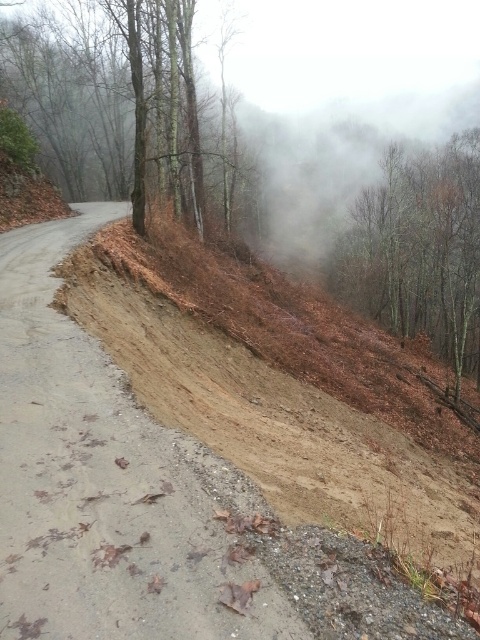
Question: Estimate the real-world distances between objects in this image. Which object is farther from the brown sandy dirt track at center?

Choices:
 (A) brown matte tree at upper right
 (B) brown bark tree at upper center

Answer: (A)

Question: Which object is farther from the camera taking this photo?

Choices:
 (A) brown matte tree at upper right
 (B) brown sandy dirt track at center
 (C) brown bark tree at upper center

Answer: (A)

Question: Which object appears farthest from the camera in this image?

Choices:
 (A) brown matte tree at upper right
 (B) brown bark tree at upper center
 (C) brown sandy dirt track at center

Answer: (A)

Question: From the image, what is the correct spatial relationship of brown bark tree at upper center in relation to brown matte tree at upper right?

Choices:
 (A) right
 (B) left

Answer: (B)

Question: Does brown sandy dirt track at center appear under brown bark tree at upper center?

Choices:
 (A) no
 (B) yes

Answer: (B)

Question: Is brown bark tree at upper center thinner than brown matte tree at upper right?

Choices:
 (A) yes
 (B) no

Answer: (A)